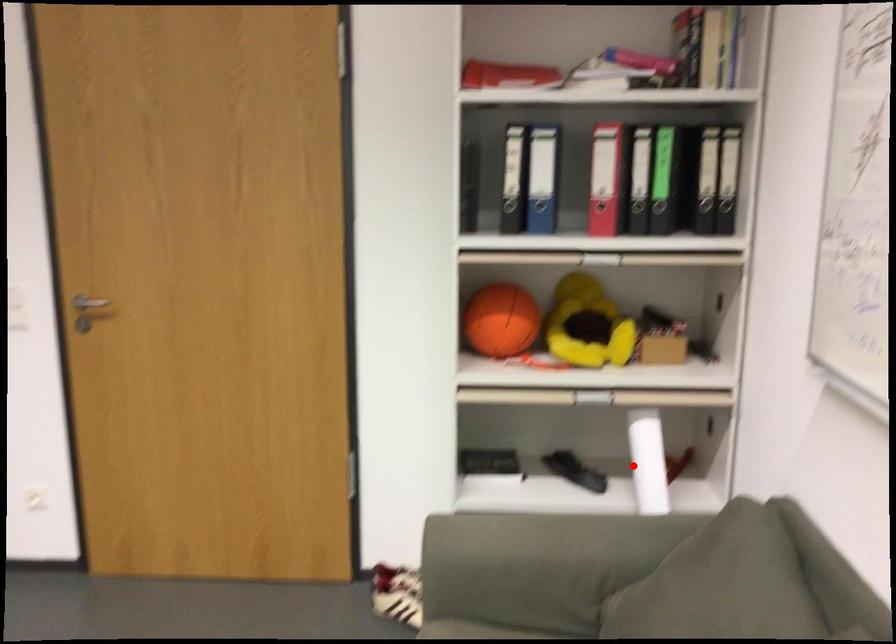
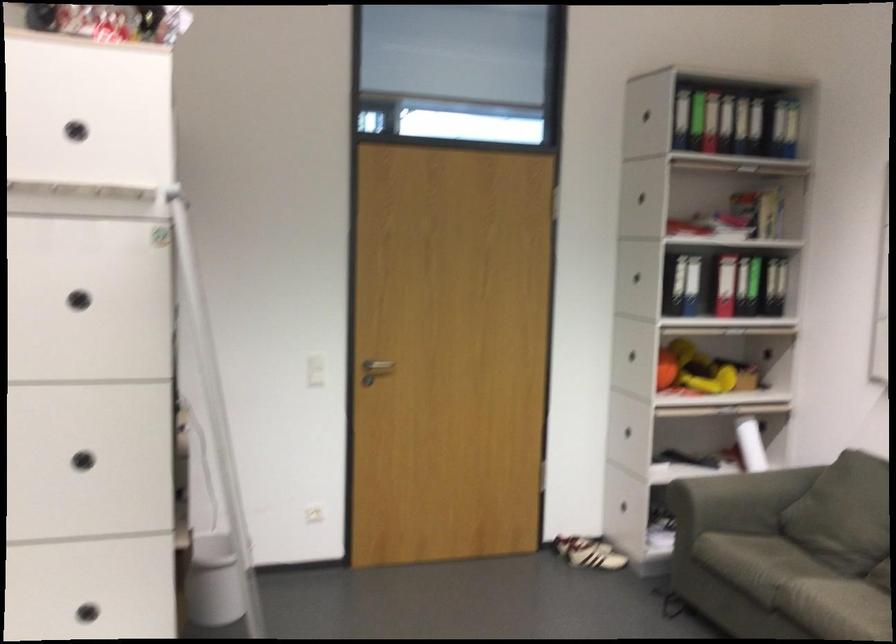
Find the pixel in the second image that matches the highlighted location in the first image.

(750, 444)